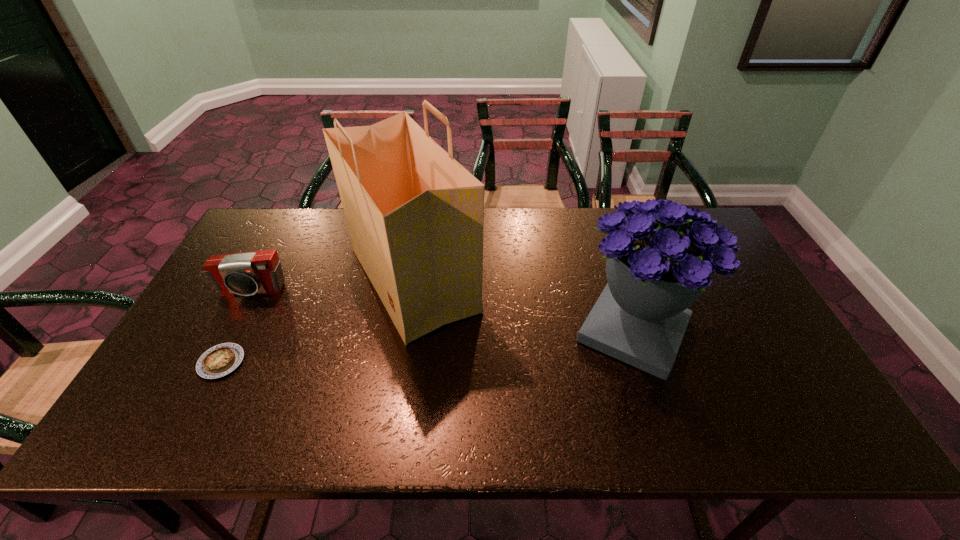
Image resolution: width=960 pixels, height=540 pixels. Find the location of `free spot between the grocery bag and the rightmost object`. free spot between the grocery bag and the rightmost object is located at coordinates pyautogui.click(x=523, y=305).

In order to click on unoccupied area between the second object from right to left and the camera in this screenshot , I will do `click(332, 285)`.

Locate an element on the screen. The width and height of the screenshot is (960, 540). unoccupied position between the grocery bag and the third tallest object is located at coordinates (332, 285).

In order to click on free point between the third tallest object and the shortest object in this screenshot , I will do `click(237, 327)`.

The height and width of the screenshot is (540, 960). Identify the location of unoccupied position between the third tallest object and the quiche. (237, 327).

Locate an element on the screen. object that is the second nearest to the tallest object is located at coordinates (220, 360).

Choose which object is the second nearest neighbor to the tallest object. Please provide its 2D coordinates. Your answer should be formatted as a tuple, i.e. [(x, y)], where the tuple contains the x and y coordinates of a point satisfying the conditions above.

[(220, 360)]

Locate an element on the screen. vacant space that satisfies the following two spatial constraints: 1. on the side of the third object from left to right with the superhero design; 2. on the front-facing side of the camera is located at coordinates (411, 291).

This screenshot has height=540, width=960. Find the location of `free space in the image that satisfies the following two spatial constraints: 1. on the side of the second tallest object with the superhero design; 2. on the left side of the grocery bag`. free space in the image that satisfies the following two spatial constraints: 1. on the side of the second tallest object with the superhero design; 2. on the left side of the grocery bag is located at coordinates (404, 330).

At what (x,y) coordinates should I click in order to perform the action: click on vacant area in the image that satisfies the following two spatial constraints: 1. on the side of the tallest object with the superhero design; 2. on the left side of the third shortest object. Please return your answer as a coordinate pair (x, y). Looking at the image, I should click on (404, 330).